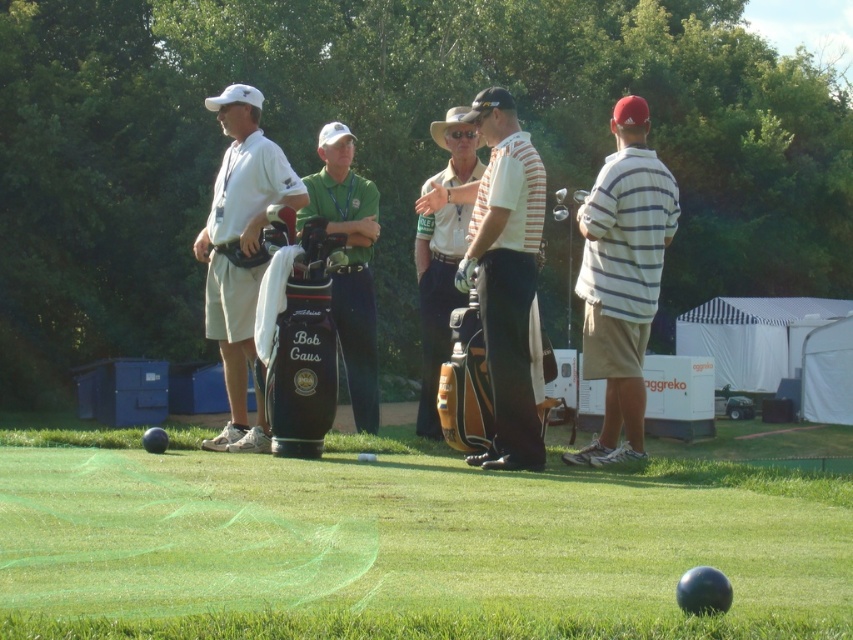
You are a golfer who just arrived at the practice area. You see the smooth green turf at lower center and the leather golf bag at center. Which object is located to the right of the other?

The smooth green turf at lower center is positioned on the right side of the leather golf bag at center, so the smooth green turf at lower center is to the right of the leather golf bag at center.

You are a photographer trying to capture a group photo of the striped cotton shirt at right and the white matte golf bag at left. Since you want to ensure both subjects are fully visible in the frame, which subject should you position closer to the camera to avoid cropping?

The striped cotton shirt at right is not as tall as the white matte golf bag at left, so position the striped cotton shirt at right closer to the camera to ensure it remains visible without being cropped.

In the scene shown: You are a golfer who wants to place your leather golf bag at center on the smooth green turf at lower center. Will the turf be able to fully support the bag?

The smooth green turf at lower center is smaller than the leather golf bag at center, so it may not fully support the bag due to its smaller size.